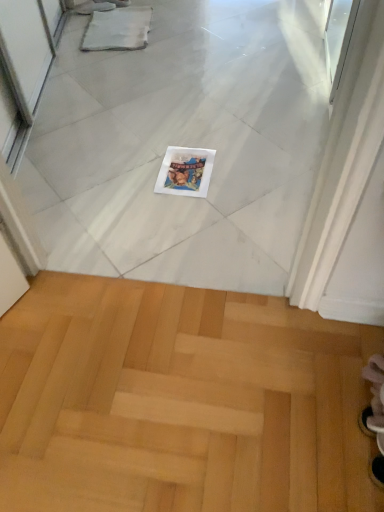
Identify the location of light wood parquet floor at lower center. Image resolution: width=384 pixels, height=512 pixels. (179, 401).

In order to face light wood parquet floor at lower center, should I rotate leftwards or rightwards?

It's best to rotate left around 2.838 degrees.

What is the approximate width of light wood parquet floor at lower center?

The width of light wood parquet floor at lower center is 68.84 centimeters.

What do you see at coordinates (179, 401) in the screenshot? I see `light wood parquet floor at lower center` at bounding box center [179, 401].

This screenshot has width=384, height=512. What do you see at coordinates (185, 170) in the screenshot?
I see `white glossy magazine at center` at bounding box center [185, 170].

Locate an element on the screen. The height and width of the screenshot is (512, 384). white glossy magazine at center is located at coordinates (185, 170).

The image size is (384, 512). I want to click on light wood parquet floor at lower center, so click(179, 401).

Is light wood parquet floor at lower center to the left of white glossy magazine at center from the viewer's perspective?

Yes.

Considering the positions of objects light wood parquet floor at lower center and white glossy magazine at center in the image provided, who is behind, light wood parquet floor at lower center or white glossy magazine at center?

white glossy magazine at center is behind.

Which is behind, point (2, 485) or point (207, 165)?

Point (207, 165)

From the image's perspective, is light wood parquet floor at lower center above or below white glossy magazine at center?

From the image's perspective, light wood parquet floor at lower center appears below white glossy magazine at center.

From a real-world perspective, which is physically below, light wood parquet floor at lower center or white glossy magazine at center?

light wood parquet floor at lower center, from a real-world perspective.

Between light wood parquet floor at lower center and white glossy magazine at center, which one has larger width?

Wider between the two is light wood parquet floor at lower center.

In the scene shown: Who is taller, light wood parquet floor at lower center or white glossy magazine at center?

Standing taller between the two is light wood parquet floor at lower center.

Which of these two, light wood parquet floor at lower center or white glossy magazine at center, is bigger?

Bigger between the two is light wood parquet floor at lower center.

Would you say light wood parquet floor at lower center is outside white glossy magazine at center?

light wood parquet floor at lower center lies outside white glossy magazine at center's area.

Would you consider light wood parquet floor at lower center to be distant from white glossy magazine at center?

No, light wood parquet floor at lower center is not far from white glossy magazine at center.

Could you tell me if light wood parquet floor at lower center is turned towards white glossy magazine at center?

Yes, light wood parquet floor at lower center is facing white glossy magazine at center.

How distant is light wood parquet floor at lower center from white glossy magazine at center?

76.51 centimeters.

Locate an element on the screen. The width and height of the screenshot is (384, 512). stairwell located on the left of white glossy magazine at center is located at coordinates (179, 401).

From the picture: Can you confirm if white glossy magazine at center is positioned to the right of light wood parquet floor at lower center?

Indeed, white glossy magazine at center is positioned on the right side of light wood parquet floor at lower center.

Does white glossy magazine at center lie behind light wood parquet floor at lower center?

Yes, it is.

Is point (181, 178) positioned behind point (264, 385)?

Yes.

From the image's perspective, is white glossy magazine at center positioned above or below light wood parquet floor at lower center?

From the image's perspective, white glossy magazine at center appears above light wood parquet floor at lower center.

From a real-world perspective, is white glossy magazine at center above or below light wood parquet floor at lower center?

Clearly, from a real-world perspective, white glossy magazine at center is above light wood parquet floor at lower center.

Which of these two, white glossy magazine at center or light wood parquet floor at lower center, is wider?

light wood parquet floor at lower center.

Which of these two, white glossy magazine at center or light wood parquet floor at lower center, stands taller?

light wood parquet floor at lower center is taller.

Is white glossy magazine at center bigger than light wood parquet floor at lower center?

Incorrect, white glossy magazine at center is not larger than light wood parquet floor at lower center.

Is white glossy magazine at center positioned beyond the bounds of light wood parquet floor at lower center?

Indeed, white glossy magazine at center is completely outside light wood parquet floor at lower center.

Are white glossy magazine at center and light wood parquet floor at lower center located far from each other?

white glossy magazine at center is near light wood parquet floor at lower center, not far away.

In the scene shown: Is light wood parquet floor at lower center at the back of white glossy magazine at center?

No, white glossy magazine at center is not facing the opposite direction of light wood parquet floor at lower center.

How far apart are white glossy magazine at center and light wood parquet floor at lower center?

white glossy magazine at center and light wood parquet floor at lower center are 30.12 inches apart from each other.

At what (x,y) coordinates should I click in order to perform the action: click on stairwell on the left of the white glossy magazine at center. Please return your answer as a coordinate pair (x, y). Looking at the image, I should click on (179, 401).

The width and height of the screenshot is (384, 512). In the image, there is a white glossy magazine at center. Identify the location of stairwell below it (from the image's perspective). (179, 401).

This screenshot has height=512, width=384. I want to click on stairwell below the white glossy magazine at center (from a real-world perspective), so click(x=179, y=401).